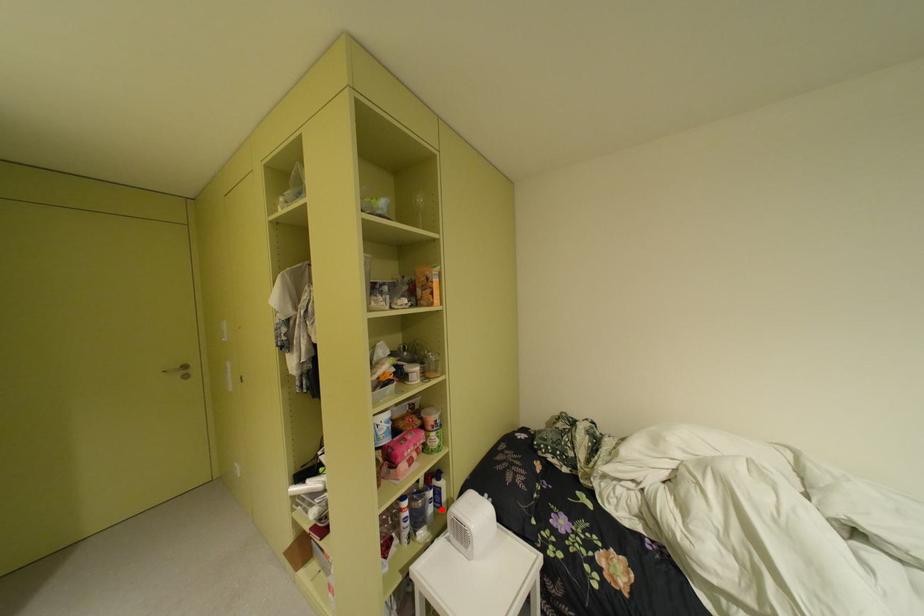
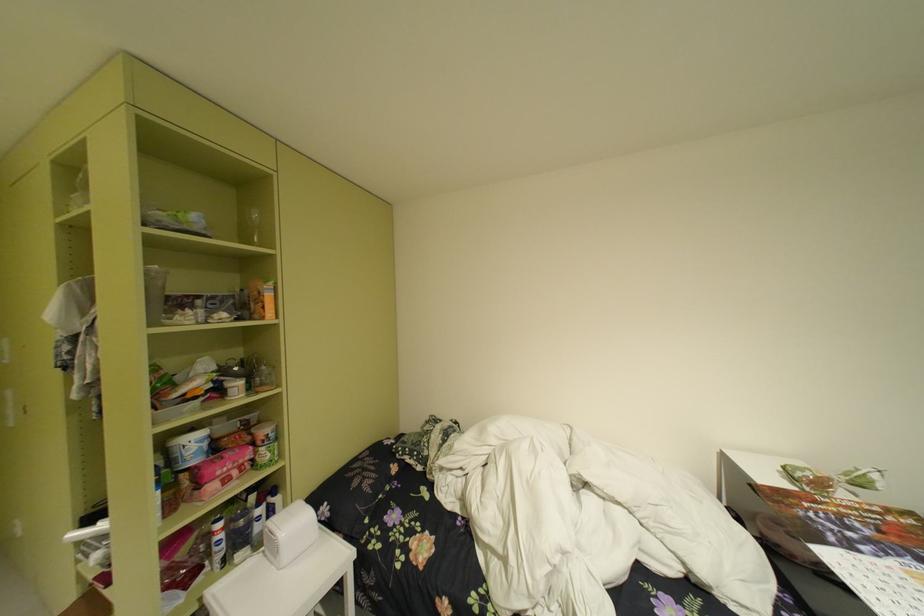
Locate, in the second image, the point that corresponds to the highlighted location in the first image.

(269, 528)